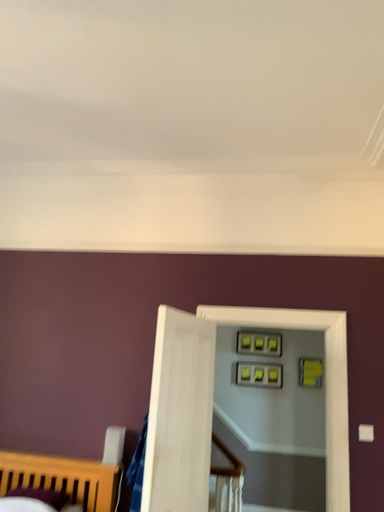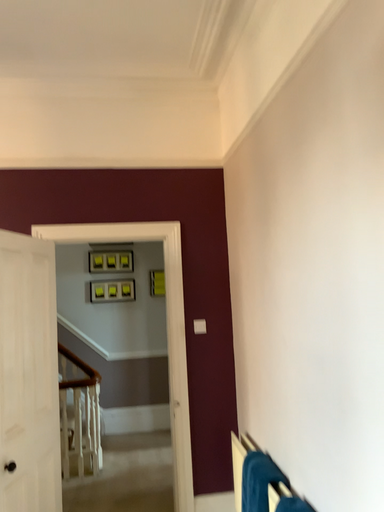
Question: How did the camera likely rotate when shooting the video?

Choices:
 (A) rotated upward
 (B) rotated downward

Answer: (B)